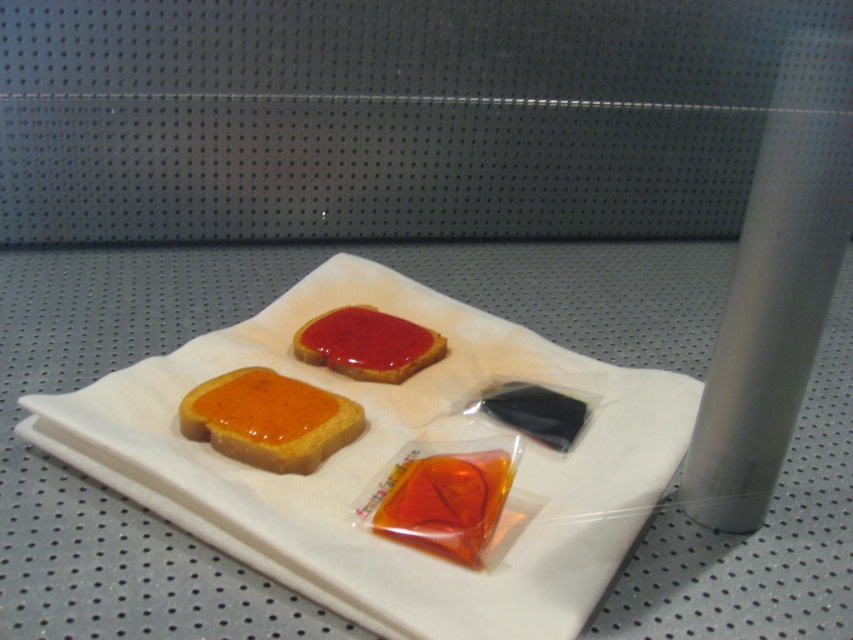
Question: Is matte orange toast at center above matte red toast at center?

Choices:
 (A) no
 (B) yes

Answer: (A)

Question: Can you confirm if matte orange toast at center is positioned to the right of translucent orange gel at center?

Choices:
 (A) no
 (B) yes

Answer: (A)

Question: Can you confirm if matte orange toast at center is positioned to the right of matte red toast at center?

Choices:
 (A) no
 (B) yes

Answer: (A)

Question: Which point is farther to the camera?

Choices:
 (A) (375, 528)
 (B) (354, 406)
 (C) (315, 353)

Answer: (C)

Question: Among these points, which one is nearest to the camera?

Choices:
 (A) (331, 356)
 (B) (473, 541)

Answer: (B)

Question: Which of the following is the closest to the observer?

Choices:
 (A) (247, 384)
 (B) (364, 362)
 (C) (471, 488)

Answer: (C)